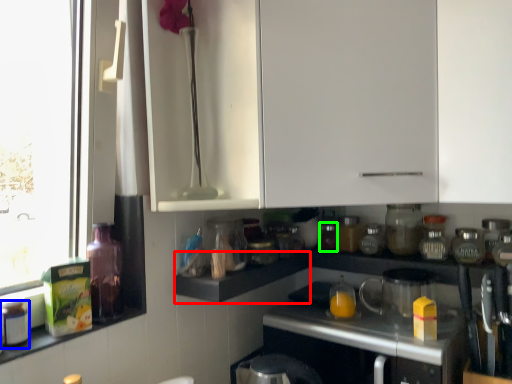
Question: Estimate the real-world distances between objects in this image. Which object is farther from shelf (highlighted by a red box), bottle (highlighted by a blue box) or bottle (highlighted by a green box)?

Choices:
 (A) bottle
 (B) bottle

Answer: (A)